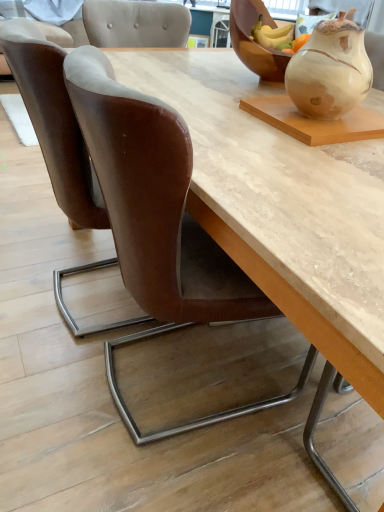
Question: Is wooden bowl at upper right inside or outside of matte ceramic vase at upper right?

Choices:
 (A) outside
 (B) inside

Answer: (A)

Question: From the image's perspective, relative to matte ceramic vase at upper right, is wooden bowl at upper right above or below?

Choices:
 (A) above
 (B) below

Answer: (A)

Question: Estimate the real-world distances between objects in this image. Which object is closer to the wooden bowl at upper right?

Choices:
 (A) matte ceramic vase at upper right
 (B) brown leather chair at lower left, marked as the second chair in a right-to-left arrangement
 (C) brown leather chair at left, marked as the first chair in a right-to-left arrangement

Answer: (A)

Question: Considering the real-world distances, which object is closest to the brown leather chair at lower left, marked as the second chair in a right-to-left arrangement?

Choices:
 (A) matte ceramic vase at upper right
 (B) brown leather chair at left, marked as the first chair in a right-to-left arrangement
 (C) wooden bowl at upper right

Answer: (B)